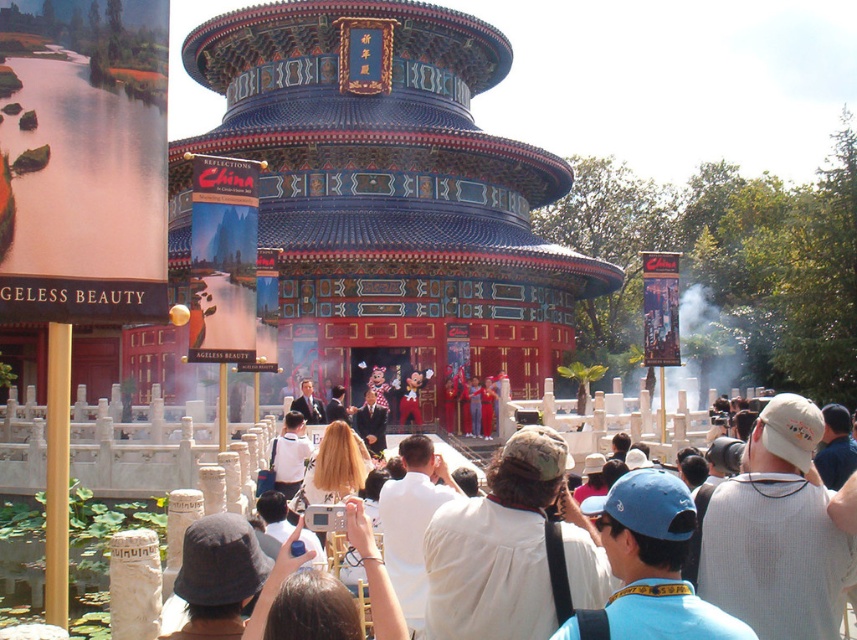
You are a photographer standing in front of the traditional Chinese pavilion. You notice a white cotton shirt at center and a white plastic camera at center. Which object is closer to you?

The white cotton shirt at center is closer to you because the white plastic camera at center is behind it.

You are a photographer standing at the camera position in the scene. You want to capture a clear photo of the white cotton shirt at center. Considering the distance, can you focus on it clearly?

The white cotton shirt at center is 30.84 meters away from the camera, so it is possible to focus on it clearly as modern cameras can focus on objects at that distance.